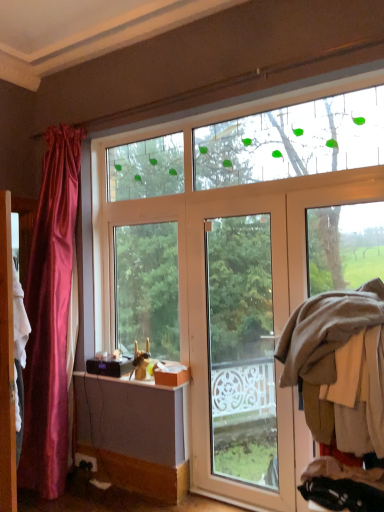
The image size is (384, 512). What do you see at coordinates (239, 353) in the screenshot?
I see `white glossy door at center` at bounding box center [239, 353].

The image size is (384, 512). What do you see at coordinates (7, 364) in the screenshot?
I see `wooden screen door at left` at bounding box center [7, 364].

Image resolution: width=384 pixels, height=512 pixels. In order to click on brown woolen sweater at right in this screenshot , I will do (x=335, y=365).

Between brown woolen sweater at right and wooden screen door at left, which one appears on the left side from the viewer's perspective?

wooden screen door at left.

Is brown woolen sweater at right facing towards wooden screen door at left?

No, brown woolen sweater at right is not turned towards wooden screen door at left.

Is brown woolen sweater at right in contact with wooden screen door at left?

brown woolen sweater at right is not next to wooden screen door at left, and they're not touching.

Is point (306, 332) closer to camera compared to point (1, 197)?

Yes, it is in front of point (1, 197).

Considering the relative sizes of wooden screen door at left and white glossy door at center in the image provided, is wooden screen door at left thinner than white glossy door at center?

No, wooden screen door at left is not thinner than white glossy door at center.

Considering the sizes of objects wooden screen door at left and white glossy door at center in the image provided, who is bigger, wooden screen door at left or white glossy door at center?

Bigger between the two is white glossy door at center.

Is there a large distance between wooden screen door at left and white glossy door at center?

Yes.

Would you say brown woolen sweater at right is to the left or to the right of white glossy door at center in the picture?

Based on their positions, brown woolen sweater at right is located to the right of white glossy door at center.

Identify the location of laundry above the white glossy door at center (from a real-world perspective). (x=335, y=365).

Is white glossy door at center a part of brown woolen sweater at right?

That's incorrect, white glossy door at center is not inside brown woolen sweater at right.

From the picture: Considering the relative sizes of brown woolen sweater at right and white glossy door at center in the image provided, is brown woolen sweater at right thinner than white glossy door at center?

In fact, brown woolen sweater at right might be wider than white glossy door at center.

Which of these two, white glossy door at center or wooden screen door at left, is wider?

wooden screen door at left.

Can you confirm if white glossy door at center is bigger than wooden screen door at left?

Indeed, white glossy door at center has a larger size compared to wooden screen door at left.

Considering the relative positions of white glossy door at center and wooden screen door at left in the image provided, is white glossy door at center to the left of wooden screen door at left from the viewer's perspective?

No.

From the image's perspective, is white glossy door at center beneath brown woolen sweater at right?

Yes, from the image's perspective, white glossy door at center is beneath brown woolen sweater at right.

How different are the orientations of white glossy door at center and brown woolen sweater at right in degrees?

The angle between the facing direction of white glossy door at center and the facing direction of brown woolen sweater at right is 1.23 degrees.

Is white glossy door at center facing towards brown woolen sweater at right?

No, white glossy door at center does not turn towards brown woolen sweater at right.

Is white glossy door at center in front of or behind brown woolen sweater at right in the image?

Clearly, white glossy door at center is behind brown woolen sweater at right.

Is wooden screen door at left bigger or smaller than brown woolen sweater at right?

In the image, wooden screen door at left appears to be smaller than brown woolen sweater at right.

Is wooden screen door at left facing away from brown woolen sweater at right?

No, wooden screen door at left is not facing away from brown woolen sweater at right.

Does point (9, 322) lie behind point (342, 443)?

That is True.

Which object is thinner, wooden screen door at left or brown woolen sweater at right?

Thinner between the two is wooden screen door at left.

Identify the location of screen door below the brown woolen sweater at right (from the image's perspective). The width and height of the screenshot is (384, 512). (7, 364).

In order to click on screen door above the white glossy door at center (from a real-world perspective) in this screenshot , I will do `click(7, 364)`.

Considering their positions, is wooden screen door at left positioned closer to brown woolen sweater at right than white glossy door at center?

white glossy door at center is closer to brown woolen sweater at right.

Looking at the image, which one is located further to white glossy door at center, wooden screen door at left or brown woolen sweater at right?

Among the two, wooden screen door at left is located further to white glossy door at center.

From the image, which object appears to be farther from brown woolen sweater at right, white glossy door at center or wooden screen door at left?

wooden screen door at left lies further to brown woolen sweater at right than the other object.

When comparing their distances from wooden screen door at left, does brown woolen sweater at right or white glossy door at center seem closer?

The object closer to wooden screen door at left is brown woolen sweater at right.

From the image, which object appears to be nearer to white glossy door at center, brown woolen sweater at right or wooden screen door at left?

brown woolen sweater at right lies closer to white glossy door at center than the other object.

In the scene shown: From the image, which object appears to be farther from wooden screen door at left, white glossy door at center or brown woolen sweater at right?

Based on the image, white glossy door at center appears to be further to wooden screen door at left.

Find the location of a particular element. Image resolution: width=384 pixels, height=512 pixels. door situated between wooden screen door at left and brown woolen sweater at right from left to right is located at coordinates (239, 353).